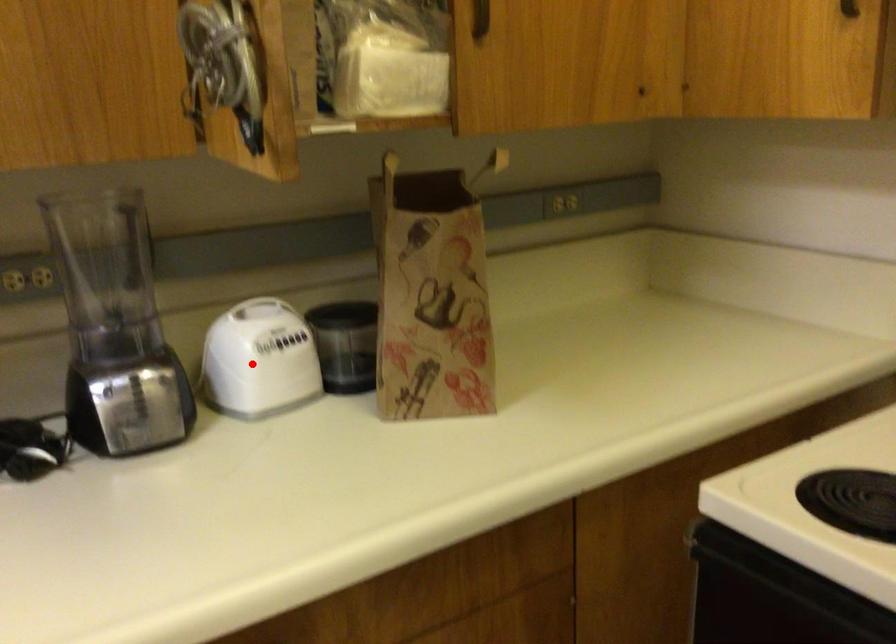
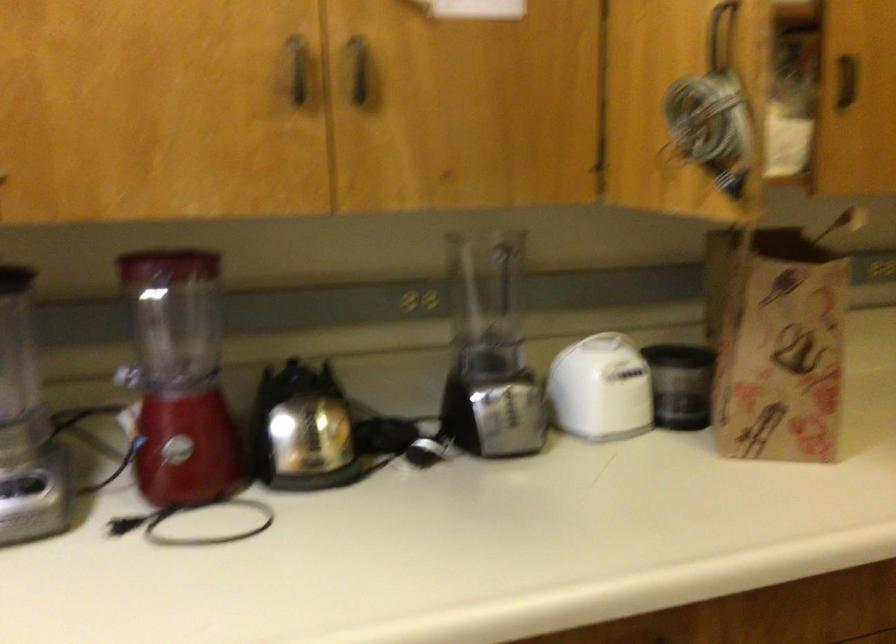
Find the pixel in the second image that matches the highlighted location in the first image.

(600, 389)